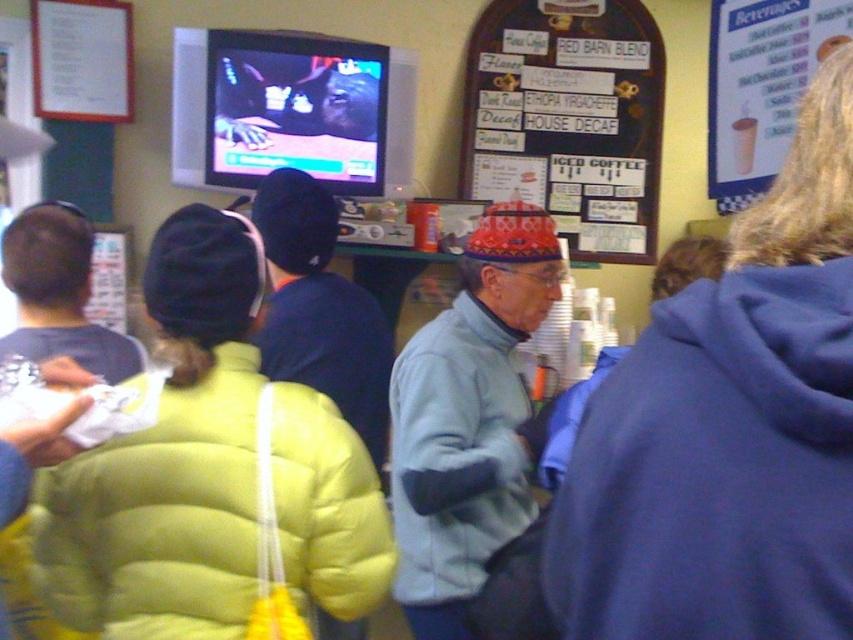
You are a photographer trying to capture a group photo of the blue fleece jacket at right and the yellow puffer jacket at center. Since you want both subjects to be in the frame, which direction should you move to ensure both are visible?

The blue fleece jacket at right is positioned on the right side of the yellow puffer jacket at center, so moving to the left of the yellow puffer jacket at center would allow both the blue fleece jacket at right and the yellow puffer jacket at center to be in the frame.